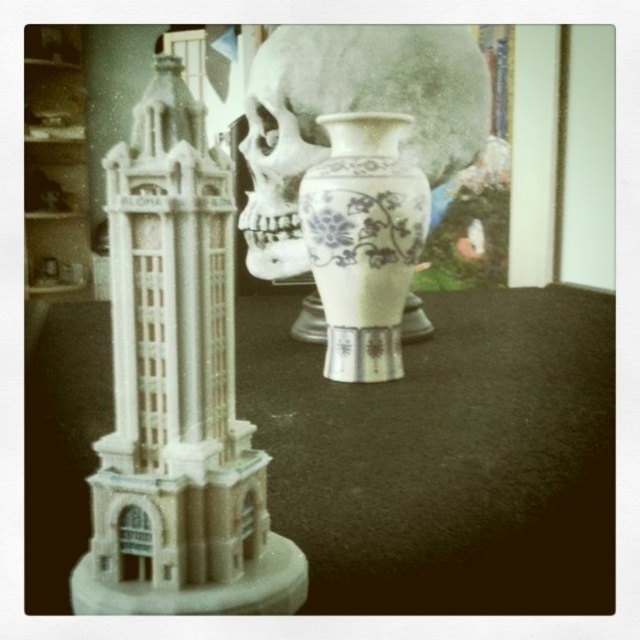
Question: Which of the following is the closest to the observer?

Choices:
 (A) white matte tower at left
 (B) white glossy skull at center
 (C) white porcelain vase at center

Answer: (A)

Question: Can you confirm if white glossy skull at center is positioned above white porcelain vase at center?

Choices:
 (A) no
 (B) yes

Answer: (B)

Question: In this image, where is white matte tower at left located relative to white glossy skull at center?

Choices:
 (A) left
 (B) right

Answer: (A)

Question: Which object appears farthest from the camera in this image?

Choices:
 (A) white matte tower at left
 (B) white glossy skull at center

Answer: (B)

Question: Is white matte tower at left bigger than white glossy skull at center?

Choices:
 (A) no
 (B) yes

Answer: (A)

Question: Which object is closer to the camera taking this photo?

Choices:
 (A) white matte tower at left
 (B) white glossy skull at center

Answer: (A)